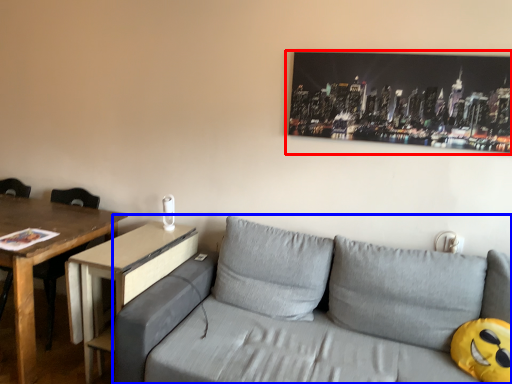
Question: Among these objects, which one is farthest to the camera, picture frame (highlighted by a red box) or studio couch (highlighted by a blue box)?

Choices:
 (A) picture frame
 (B) studio couch

Answer: (A)